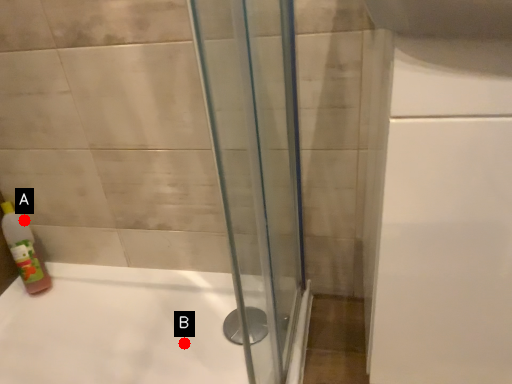
Question: Two points are circled on the image, labeled by A and B beside each circle. Which point is further to the camera?

Choices:
 (A) A is further
 (B) B is further

Answer: (A)